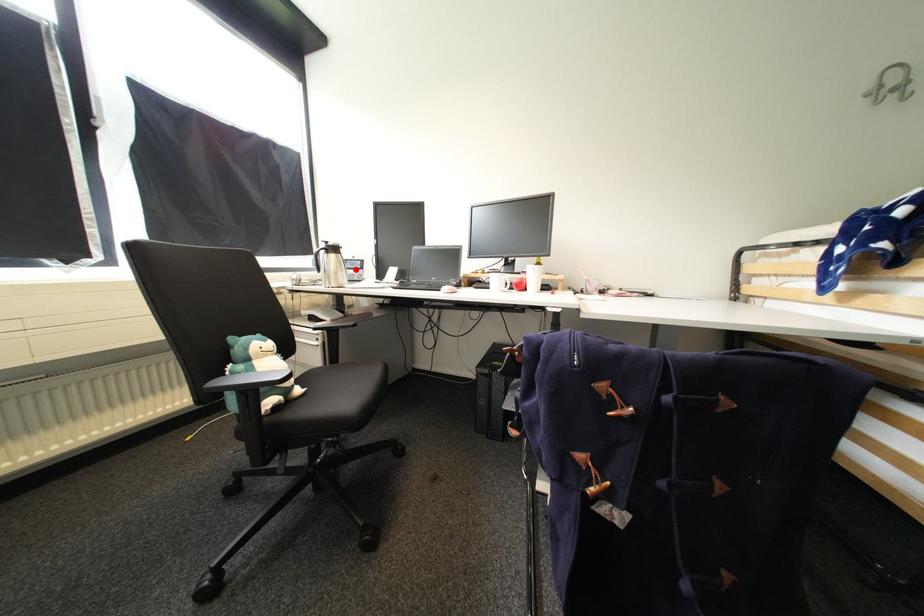
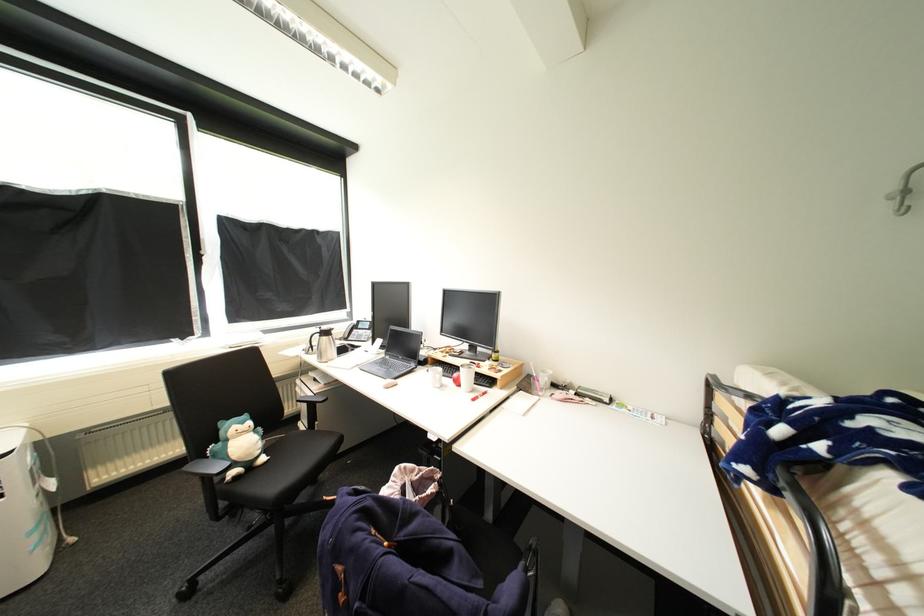
Find the pixel in the second image that matches the highlighted location in the first image.

(367, 330)